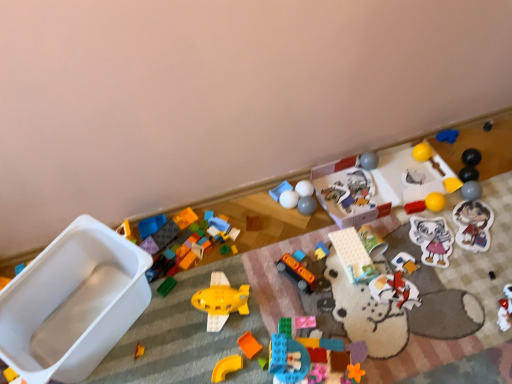
This screenshot has height=384, width=512. I want to click on free location to the right of white plastic container at left, arranged as the 25th toy when viewed from the right, so click(192, 328).